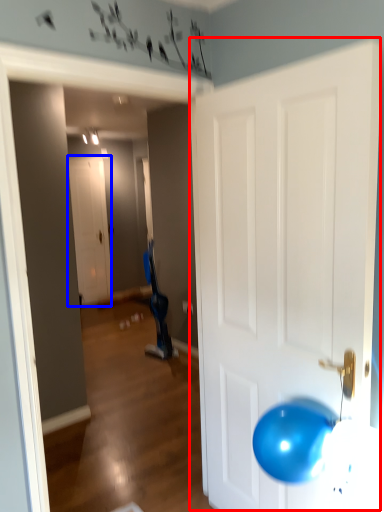
Question: Which object is closer to the camera taking this photo, door (highlighted by a red box) or door (highlighted by a blue box)?

Choices:
 (A) door
 (B) door

Answer: (A)